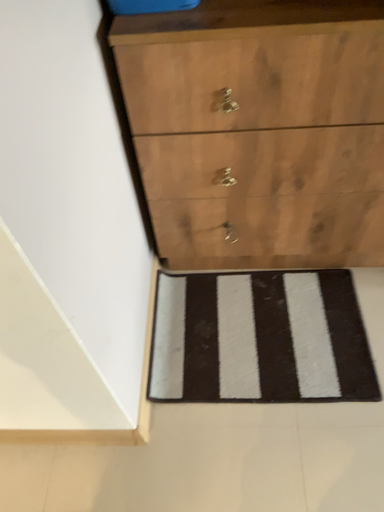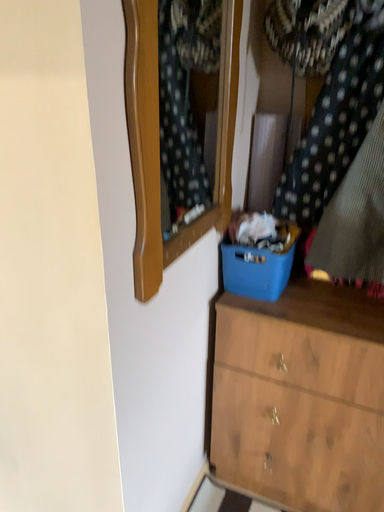
Question: How did the camera likely rotate when shooting the video?

Choices:
 (A) rotated right
 (B) rotated left

Answer: (B)